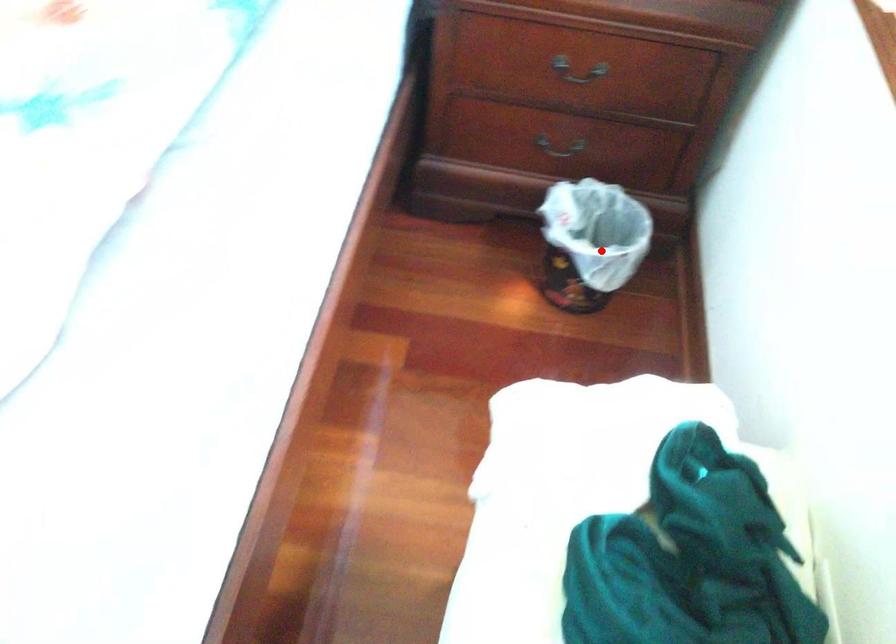
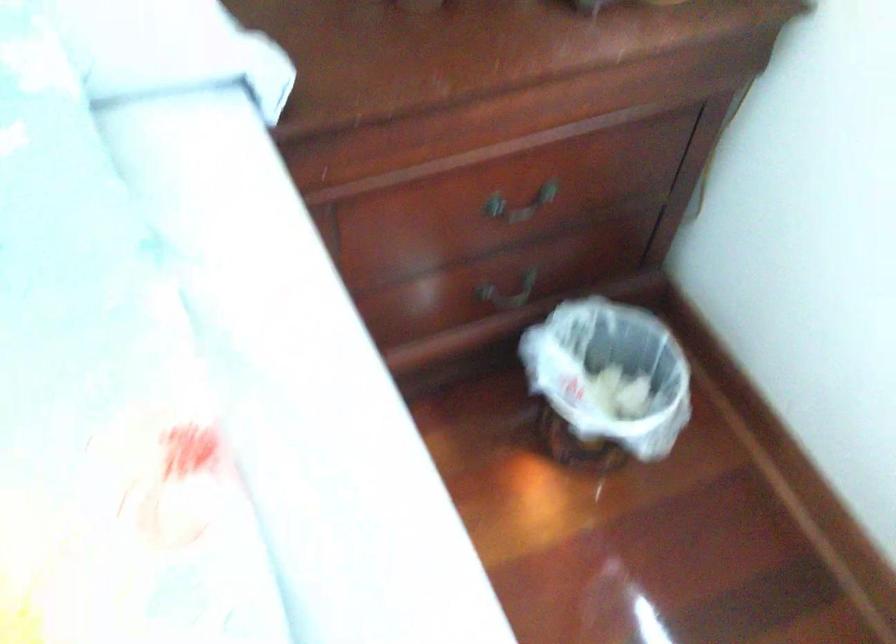
Where in the second image is the point corresponding to the highlighted location from the first image?

(606, 383)